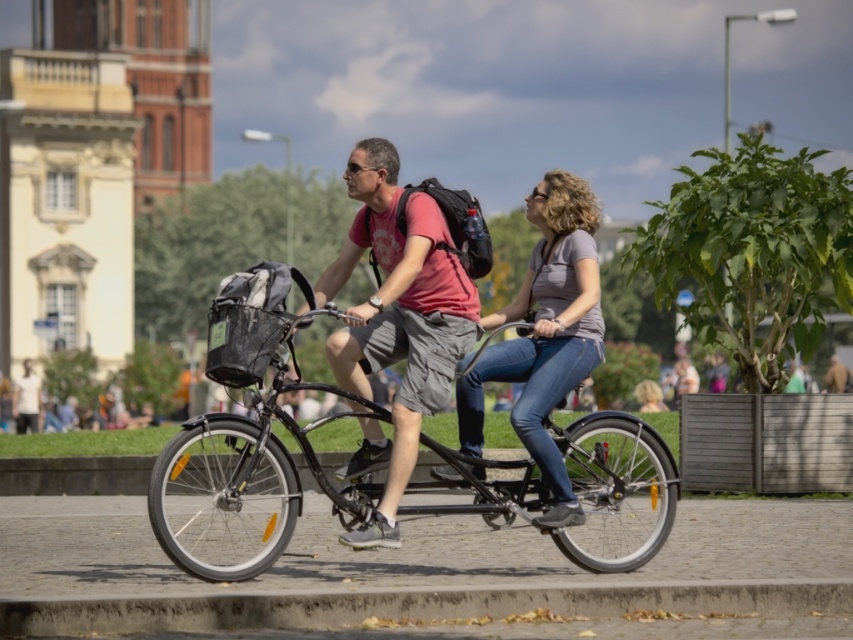
Is matte red t-shirt at center smaller than denim jeans at center?

Indeed, matte red t-shirt at center has a smaller size compared to denim jeans at center.

Based on the photo, between matte red t-shirt at center and denim jeans at center, which one is positioned higher?

matte red t-shirt at center is higher up.

Between point (444, 356) and point (480, 380), which one is positioned behind?

Point (480, 380)

What are the coordinates of `matte red t-shirt at center` in the screenshot? It's located at (396, 323).

Based on the photo, can you confirm if shiny black bicycle at center is taller than denim jeans at center?

No.

Is point (527, 504) behind point (534, 396)?

No, (527, 504) is in front of (534, 396).

Where is `shiny black bicycle at center`? Image resolution: width=853 pixels, height=640 pixels. shiny black bicycle at center is located at coordinates (244, 484).

Can you confirm if shiny black bicycle at center is smaller than matte red t-shirt at center?

No, shiny black bicycle at center is not smaller than matte red t-shirt at center.

Who is shorter, shiny black bicycle at center or matte red t-shirt at center?

Standing shorter between the two is shiny black bicycle at center.

Is point (250, 518) less distant than point (410, 346)?

No, it is not.

Locate an element on the screen. The image size is (853, 640). shiny black bicycle at center is located at coordinates (244, 484).